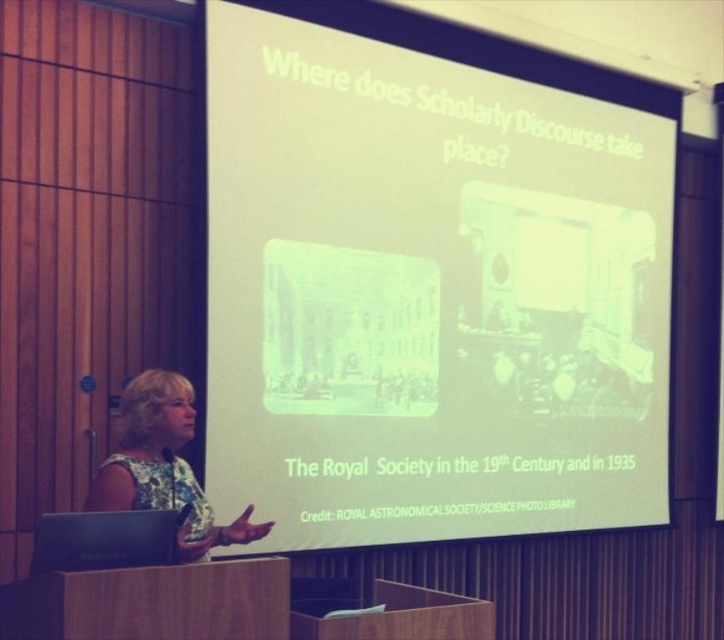
Based on the scene described, which object occupies a larger area in the image? The white matte projection screen at upper center or the floral fabric dress at lower left?

The white matte projection screen at upper center is bigger than the floral fabric dress at lower left.

You are standing at the front of the presentation room and want to check if you can comfortably reach a point marked at coordinate point (526, 84) without moving too far from your current position. Given that your maximum comfortable reach distance is 10 feet, can you reach it?

The distance of point (526, 84) from camera is 15.63 feet, which is farther than your maximum comfortable reach distance of 10 feet. Therefore, you cannot comfortably reach it without moving closer.

You are sitting in the audience and notice two points marked on the screen during the presentation. The first point is at coordinate point (631, 480) and the second is at point (117, 484). Which point is closer to you?

Point (117, 484) is closer to you because it is nearer to the camera than point (631, 480).